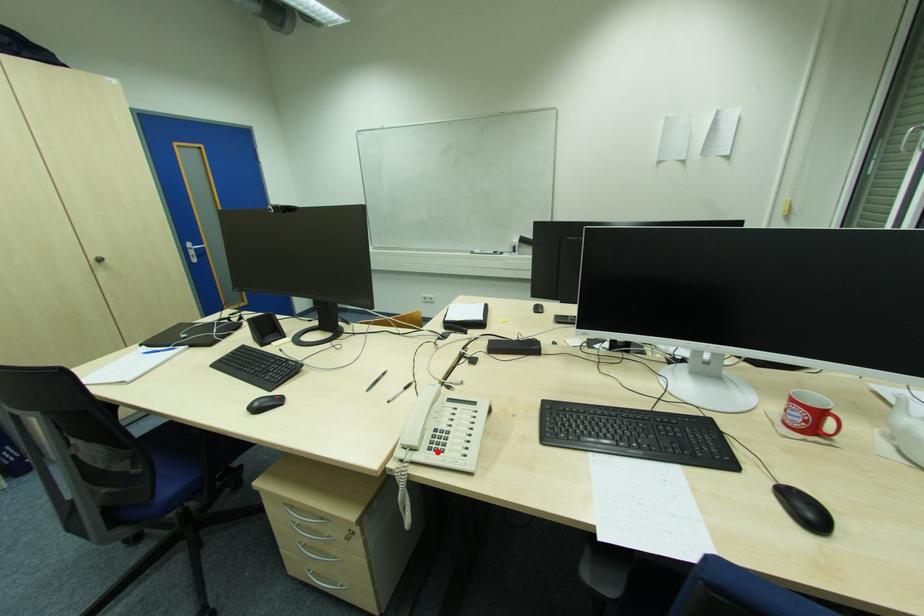
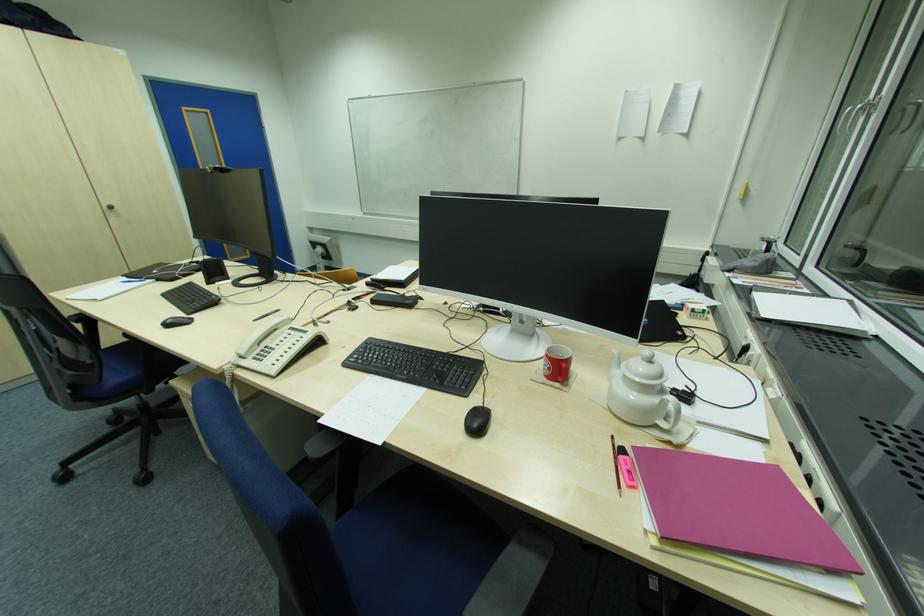
Locate, in the second image, the point that corresponds to the highlighted location in the first image.

(259, 361)